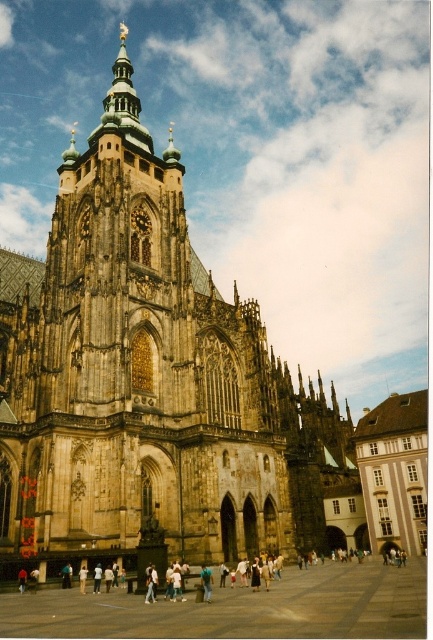
Which of these two, brown stone church at center or light blue jeans at center, stands shorter?

Standing shorter between the two is light blue jeans at center.

From the picture: Is brown stone church at center positioned before light blue jeans at center?

That is False.

You are a GUI agent. You are given a task and a screenshot of the screen. Output one action in this format:
    pyautogui.click(x=<x>, y=<y>)
    Task: Click on the brown stone church at center
    
    Given the screenshot: What is the action you would take?
    pyautogui.click(x=148, y=380)